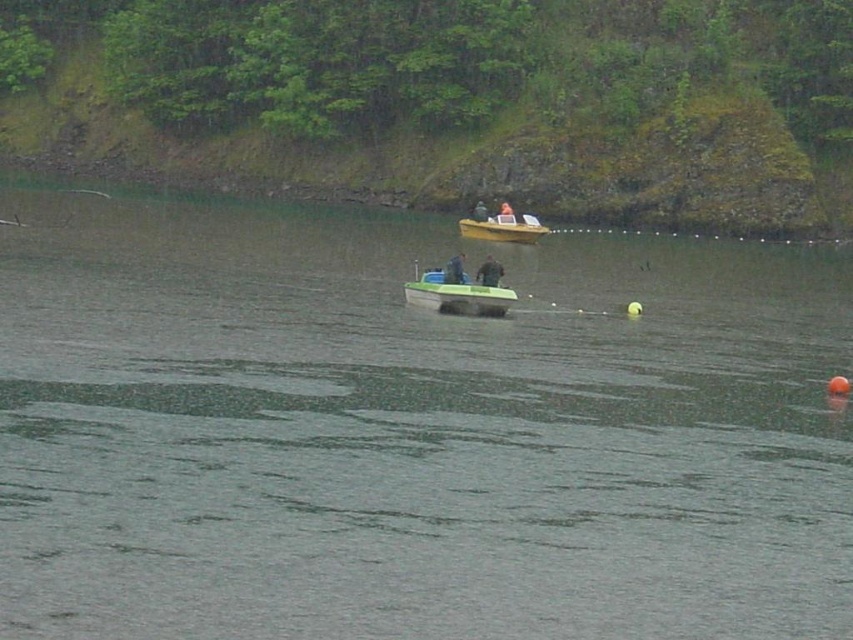
Question: Considering the real-world distances, which object is closest to the smooth yellow boat at center?

Choices:
 (A) green plastic boat at center
 (B) smooth skin face at center

Answer: (B)

Question: From the image, what is the correct spatial relationship of green plastic boat at center in relation to yellow plastic boat at center?

Choices:
 (A) above
 (B) below

Answer: (B)

Question: Based on their relative distances, which object is nearer to the dark gray fabric jacket at center?

Choices:
 (A) yellow plastic boat at center
 (B) dark green fabric jacket at center
 (C) green rubber boat at center

Answer: (B)

Question: Is yellow plastic boat at center positioned at the back of dark green fabric jacket at center?

Choices:
 (A) no
 (B) yes

Answer: (B)

Question: Is dark green fabric jacket at center closer to the viewer compared to smooth yellow boat at center?

Choices:
 (A) no
 (B) yes

Answer: (B)

Question: Which object is farther from the camera taking this photo?

Choices:
 (A) dark green fabric jacket at center
 (B) smooth yellow boat at center
 (C) yellow plastic boat at center
 (D) green rubber boat at center

Answer: (B)